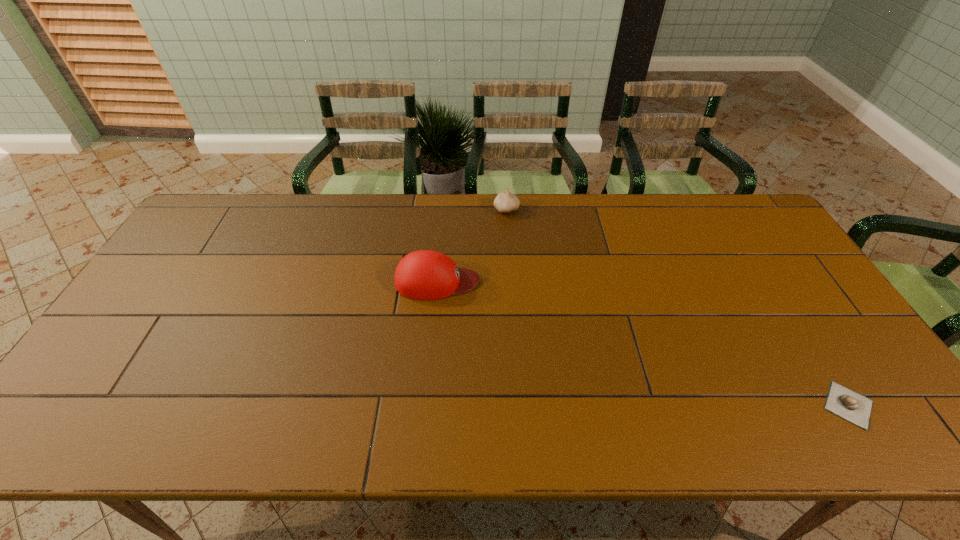
At what (x,y) coordinates should I click in order to perform the action: click on unoccupied position between the leftmost object and the shortest object. Please return your answer as a coordinate pair (x, y). The height and width of the screenshot is (540, 960). Looking at the image, I should click on (643, 343).

Locate an element on the screen. The height and width of the screenshot is (540, 960). blank region between the baseball cap and the rightmost object is located at coordinates (643, 343).

What are the coordinates of `free space that is in between the shortest object and the tallest object` in the screenshot? It's located at (643, 343).

This screenshot has height=540, width=960. Identify the location of blank region between the left garlic and the baseball cap. (472, 245).

In order to click on free space between the right garlic and the second object from right to left in this screenshot , I will do `click(678, 307)`.

I want to click on vacant area that lies between the second tallest object and the nearest object, so click(678, 307).

Identify the location of empty space that is in between the baseball cap and the second shortest object. The height and width of the screenshot is (540, 960). (472, 245).

I want to click on blank region between the shorter garlic and the tallest object, so [643, 343].

At what (x,y) coordinates should I click in order to perform the action: click on vacant region between the baseball cap and the nearest object. Please return your answer as a coordinate pair (x, y). The width and height of the screenshot is (960, 540). Looking at the image, I should click on (643, 343).

Identify the location of object identified as the second closest to the left garlic. (841, 401).